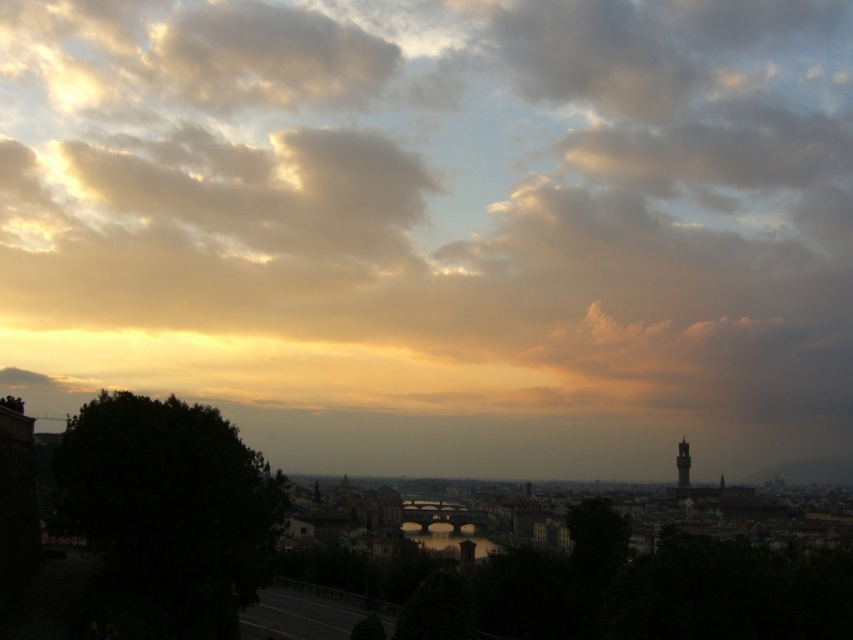
Can you confirm if cloudy sky at upper center is shorter than dark gray stone tower at right?

Incorrect, cloudy sky at upper center's height does not fall short of dark gray stone tower at right's.

Between cloudy sky at upper center and dark gray stone tower at right, which one appears on the left side from the viewer's perspective?

cloudy sky at upper center

Locate an element on the screen. This screenshot has height=640, width=853. cloudy sky at upper center is located at coordinates (433, 204).